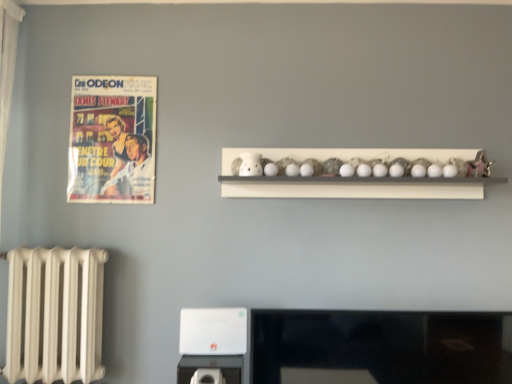
Find the location of a particular element. Image resolution: width=512 pixels, height=384 pixels. vacant point above white plastic appliance at lower center (from a real-world perspective) is located at coordinates (210, 351).